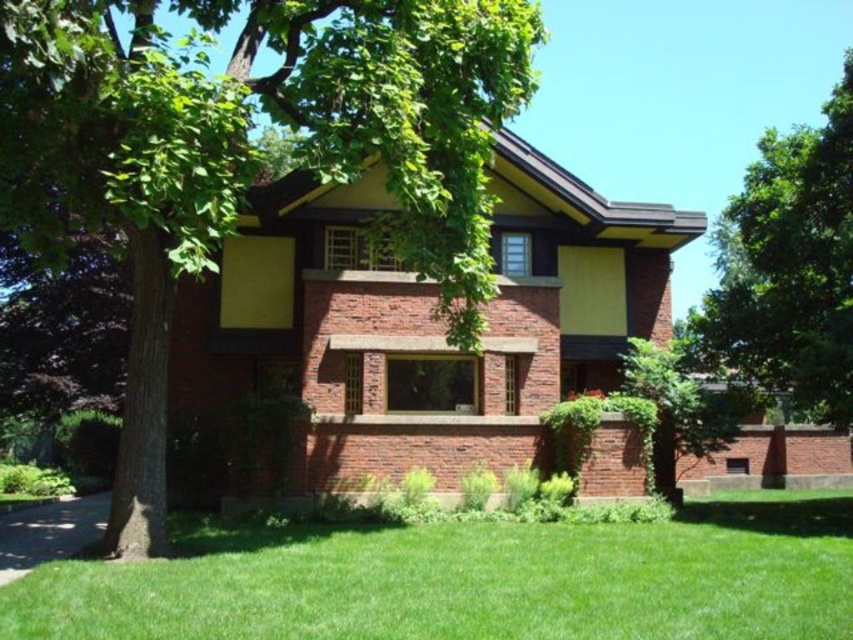
Between green leafy tree at upper left and green grass at lower center, which one is positioned lower?

green grass at lower center

Who is positioned more to the right, green leafy tree at upper left or green grass at lower center?

From the viewer's perspective, green grass at lower center appears more on the right side.

What do you see at coordinates (248, 154) in the screenshot?
I see `green leafy tree at upper left` at bounding box center [248, 154].

Find the location of a particular element. This screenshot has height=640, width=853. green leafy tree at upper left is located at coordinates (248, 154).

Does green leafy tree at upper left have a greater height compared to green leafy tree at lower right?

No, green leafy tree at upper left is not taller than green leafy tree at lower right.

Who is more forward, (354, 13) or (668, 362)?

Positioned in front is point (354, 13).

You are a GUI agent. You are given a task and a screenshot of the screen. Output one action in this format:
    pyautogui.click(x=<x>, y=<y>)
    Task: Click on the green leafy tree at upper left
    This screenshot has width=853, height=640.
    Given the screenshot: What is the action you would take?
    (x=248, y=154)

Who is lower down, green grass at lower center or green leafy tree at upper right?

green grass at lower center

Is green grass at lower center to the left of green leafy tree at upper right from the viewer's perspective?

Indeed, green grass at lower center is positioned on the left side of green leafy tree at upper right.

Is point (727, 538) positioned behind point (782, 170)?

No, it is in front of (782, 170).

The image size is (853, 640). In order to click on green grass at lower center in this screenshot , I will do `click(469, 580)`.